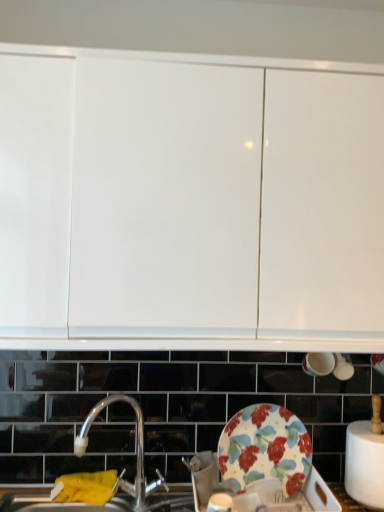
Question: From a real-world perspective, is white glossy cabinet at upper center located beneath silver metallic tap at center?

Choices:
 (A) no
 (B) yes

Answer: (A)

Question: Considering the relative sizes of white glossy cabinet at upper center and silver metallic tap at center in the image provided, is white glossy cabinet at upper center thinner than silver metallic tap at center?

Choices:
 (A) yes
 (B) no

Answer: (B)

Question: From the image's perspective, is white glossy cabinet at upper center on silver metallic tap at center?

Choices:
 (A) no
 (B) yes

Answer: (B)

Question: Can you confirm if white glossy cabinet at upper center is positioned to the right of silver metallic tap at center?

Choices:
 (A) yes
 (B) no

Answer: (A)

Question: Is white glossy cabinet at upper center facing away from silver metallic tap at center?

Choices:
 (A) no
 (B) yes

Answer: (A)

Question: Is white glossy cabinet at upper center not inside silver metallic tap at center?

Choices:
 (A) no
 (B) yes

Answer: (B)

Question: From the image's perspective, is silver metallic tap at center located above white glossy cabinet at upper center?

Choices:
 (A) no
 (B) yes

Answer: (A)

Question: Considering the relative positions of silver metallic tap at center and white glossy cabinet at upper center in the image provided, is silver metallic tap at center to the left of white glossy cabinet at upper center from the viewer's perspective?

Choices:
 (A) yes
 (B) no

Answer: (A)

Question: From the image's perspective, is silver metallic tap at center beneath white glossy cabinet at upper center?

Choices:
 (A) no
 (B) yes

Answer: (B)

Question: From a real-world perspective, is silver metallic tap at center over white glossy cabinet at upper center?

Choices:
 (A) no
 (B) yes

Answer: (A)

Question: Is silver metallic tap at center smaller than white glossy cabinet at upper center?

Choices:
 (A) no
 (B) yes

Answer: (B)

Question: Does silver metallic tap at center have a lesser width compared to white glossy cabinet at upper center?

Choices:
 (A) yes
 (B) no

Answer: (A)

Question: Is silver metallic tap at center further to camera compared to yellow fabric at lower left?

Choices:
 (A) yes
 (B) no

Answer: (B)